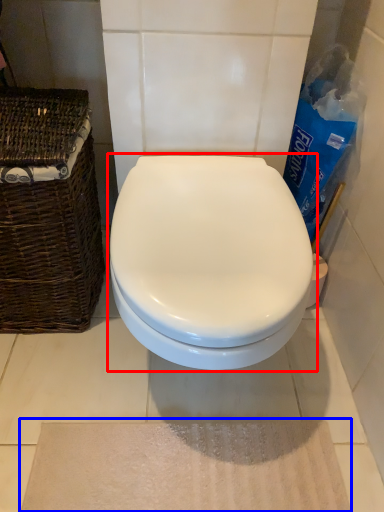
Question: Which object is closer to the camera taking this photo, toilet (highlighted by a red box) or bath mat (highlighted by a blue box)?

Choices:
 (A) toilet
 (B) bath mat

Answer: (A)